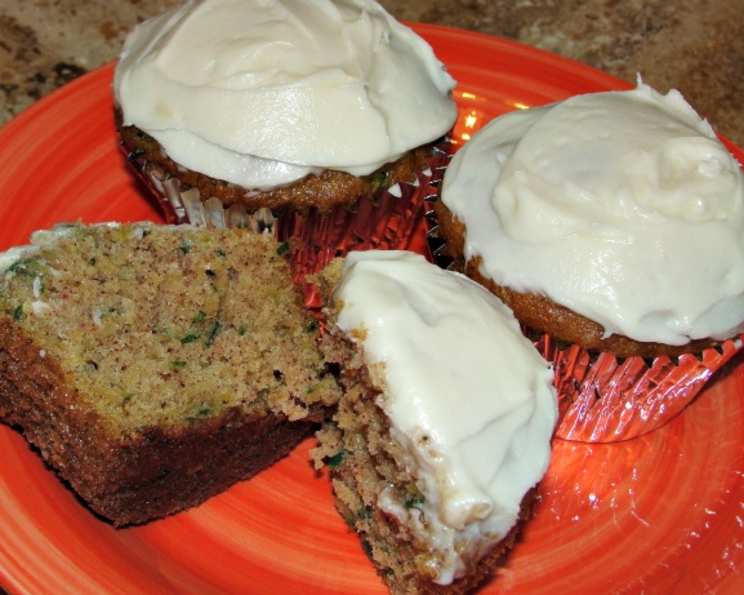
Locate an element on the screen. The width and height of the screenshot is (744, 595). countertop is located at coordinates 682,43, 85,20.